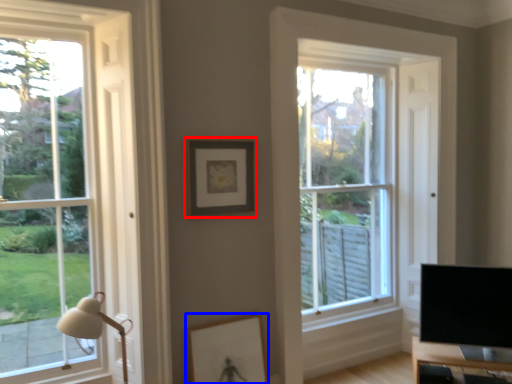
Question: Which object is closer to the camera taking this photo, picture frame (highlighted by a red box) or picture frame (highlighted by a blue box)?

Choices:
 (A) picture frame
 (B) picture frame

Answer: (B)